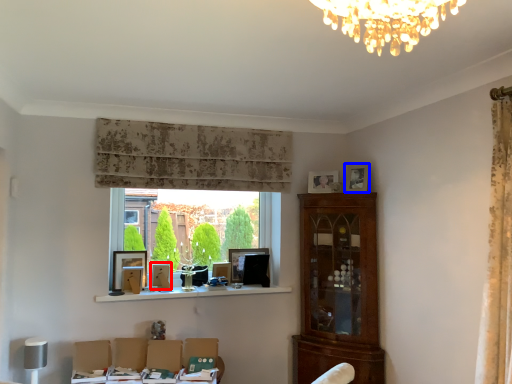
Question: Which object appears farthest to the camera in this image, picture frame (highlighted by a red box) or picture frame (highlighted by a blue box)?

Choices:
 (A) picture frame
 (B) picture frame

Answer: (A)